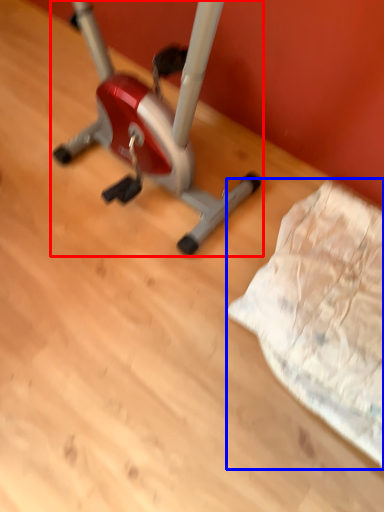
Question: Which point is closer to the camera, stationary bicycle (highlighted by a red box) or sheet (highlighted by a blue box)?

Choices:
 (A) stationary bicycle
 (B) sheet

Answer: (A)